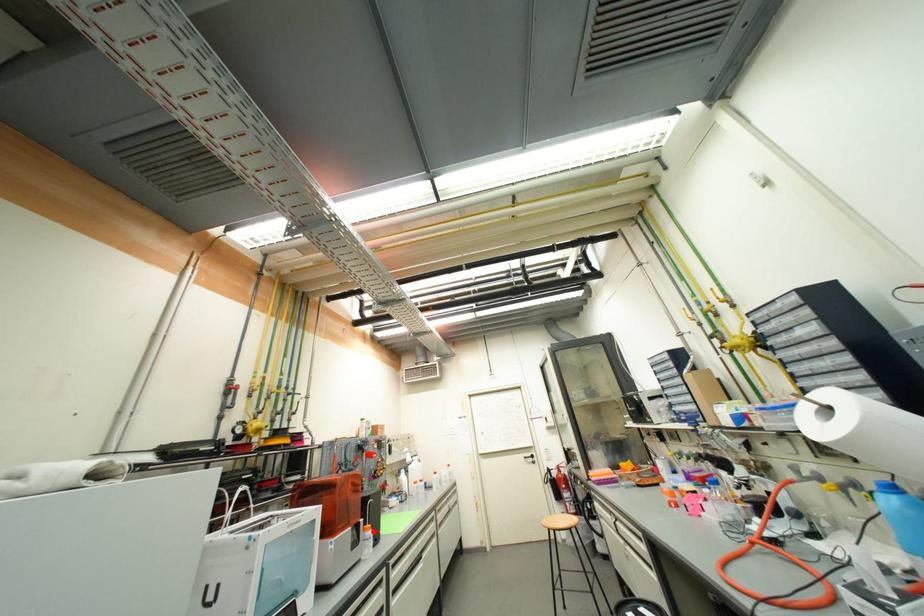
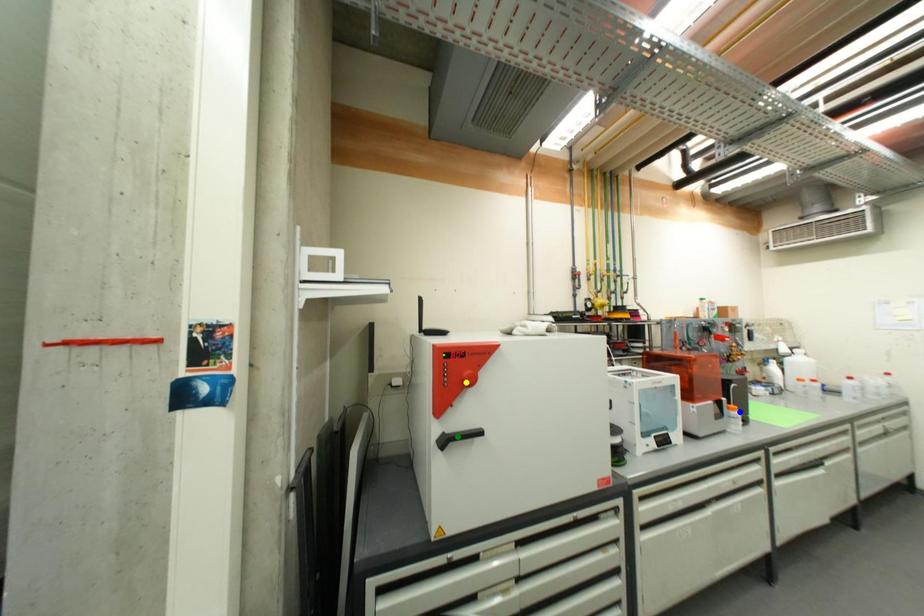
Question: I am providing you with two images of the same scene from different viewpoints. A red point is marked on the first image. You are given multiple points on the second image. Which point in image 2 represents the same 3d spot as the red point in image 1?

Choices:
 (A) green point
 (B) yellow point
 (C) blue point

Answer: (C)